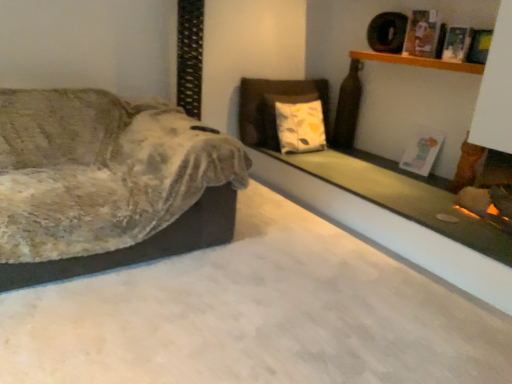
What are the coordinates of `vacant space to the right of velvet fabric couch at left` in the screenshot? It's located at click(x=292, y=261).